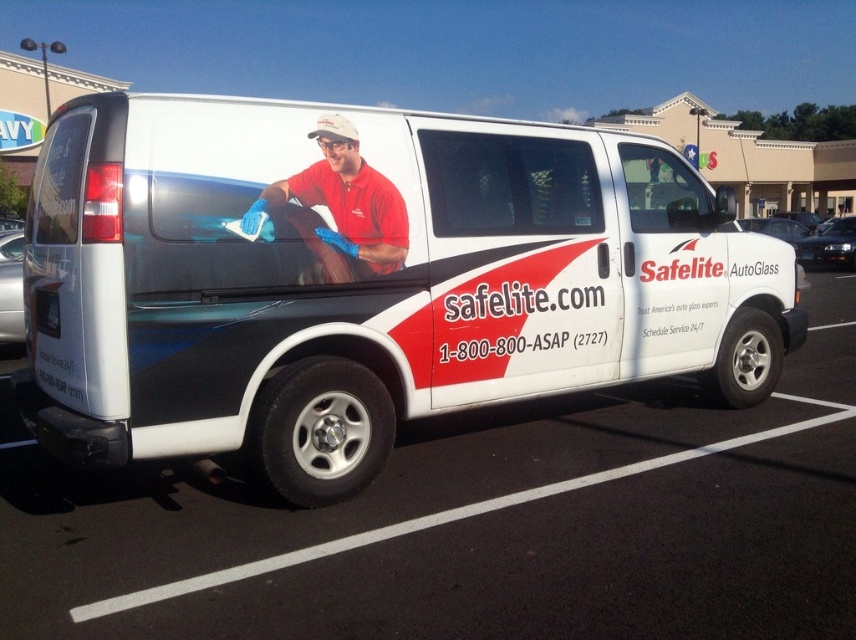
You are standing at the edge of a parking lot and see a white matte van at center and a white glossy van at center. If you want to walk to the van that is closer to you, which one should you head towards?

The white matte van at center is 4.93 meters away from the white glossy van at center. Since the white matte van is closer to you, you should head towards the white matte van at center.

You are standing at the entrance of the parking lot and want to locate the white glossy van at center. What are the coordinates of the van?

The white glossy van at center is located at coordinates point (477, 525).